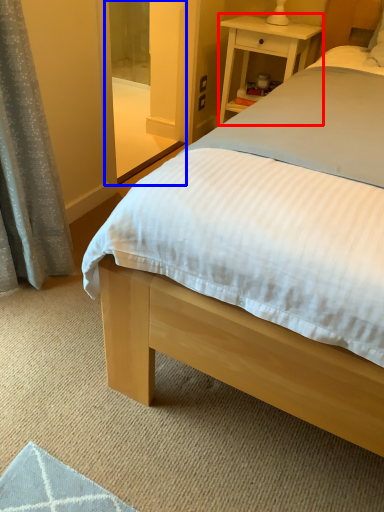
Question: Which point is further to the camera, nightstand (highlighted by a red box) or screen door (highlighted by a blue box)?

Choices:
 (A) nightstand
 (B) screen door

Answer: (A)